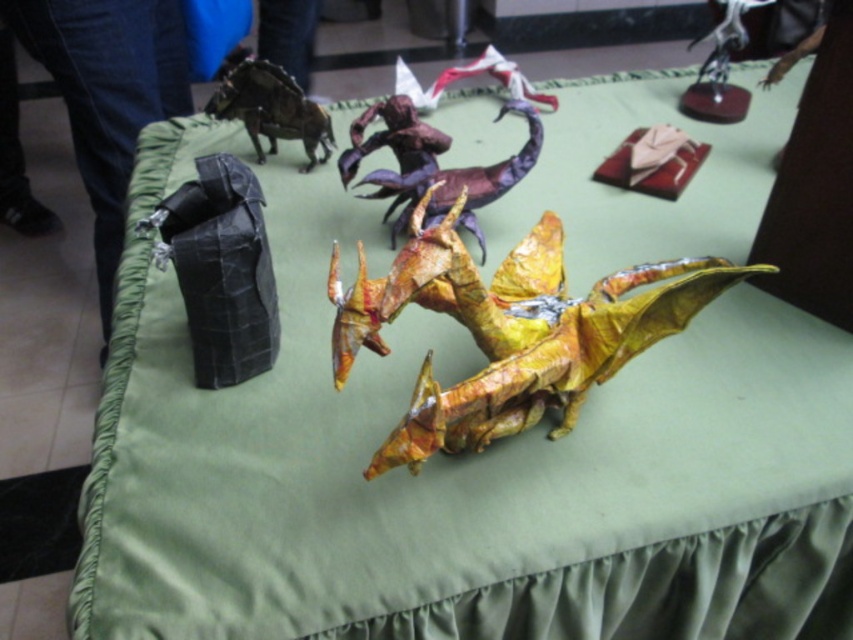
Does point (347, 157) come behind point (265, 93)?

No, (347, 157) is closer to viewer.

Which is more to the left, purple matte origami dragon at center or shiny metallic dinosaur at upper left?

From the viewer's perspective, shiny metallic dinosaur at upper left appears more on the left side.

Which is in front, point (405, 177) or point (283, 72)?

Positioned in front is point (405, 177).

Locate an element on the screen. The height and width of the screenshot is (640, 853). purple matte origami dragon at center is located at coordinates (433, 164).

Which of these two, shiny metallic dragon at center or shiny metallic dinosaur at upper left, stands shorter?

With less height is shiny metallic dinosaur at upper left.

You are a GUI agent. You are given a task and a screenshot of the screen. Output one action in this format:
    pyautogui.click(x=<x>, y=<y>)
    Task: Click on the shiny metallic dragon at center
    
    Given the screenshot: What is the action you would take?
    509,330

Identify the location of shiny metallic dragon at center. (509, 330).

Who is more distant from viewer, (553,285) or (480,241)?

The point (480,241) is more distant.

Between shiny metallic dragon at center and purple matte origami dragon at center, which one is positioned higher?

purple matte origami dragon at center

Which is behind, point (477, 296) or point (346, 157)?

The point (346, 157) is more distant.

Find the location of a particular element. This screenshot has width=853, height=640. shiny metallic dragon at center is located at coordinates (509, 330).